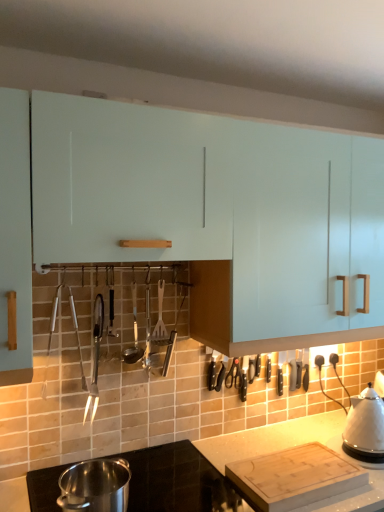
Question: Is the position of polished stainless steel ladle at center, positioned as the second silverware in right-to-left order, more distant than that of smooth white countertop at lower center?

Choices:
 (A) yes
 (B) no

Answer: (A)

Question: Is polished stainless steel ladle at center, positioned as the second silverware in right-to-left order, smaller than smooth white countertop at lower center?

Choices:
 (A) no
 (B) yes

Answer: (B)

Question: From a real-world perspective, is polished stainless steel ladle at center, which appears as the second silverware when viewed from the left, on smooth white countertop at lower center?

Choices:
 (A) no
 (B) yes

Answer: (B)

Question: Does polished stainless steel ladle at center, which appears as the second silverware when viewed from the left, have a lesser height compared to smooth white countertop at lower center?

Choices:
 (A) yes
 (B) no

Answer: (B)

Question: Considering the relative positions of polished stainless steel ladle at center, positioned as the second silverware in right-to-left order, and smooth white countertop at lower center in the image provided, is polished stainless steel ladle at center, positioned as the second silverware in right-to-left order, to the left of smooth white countertop at lower center from the viewer's perspective?

Choices:
 (A) no
 (B) yes

Answer: (B)

Question: Is white glossy kettle at right, the 2th kitchen appliance in the left-to-right sequence, in front of or behind wooden spatula at center, positioned as the third silverware in left-to-right order, in the image?

Choices:
 (A) behind
 (B) front

Answer: (B)

Question: From the image's perspective, is white glossy kettle at right, the 2th kitchen appliance in the left-to-right sequence, located above or below wooden spatula at center, which is counted as the 1th silverware, starting from the right?

Choices:
 (A) below
 (B) above

Answer: (A)

Question: From a real-world perspective, is white glossy kettle at right, which appears as the first kitchen appliance when viewed from the right, positioned above or below wooden spatula at center, positioned as the third silverware in left-to-right order?

Choices:
 (A) above
 (B) below

Answer: (B)

Question: In terms of height, does white glossy kettle at right, which appears as the first kitchen appliance when viewed from the right, look taller or shorter compared to wooden spatula at center, positioned as the third silverware in left-to-right order?

Choices:
 (A) tall
 (B) short

Answer: (B)

Question: From the image's perspective, is polished stainless steel ladle at center, positioned as the second silverware in right-to-left order, above or below polished stainless steel pot at lower left, the 2th kitchen appliance when ordered from back to front?

Choices:
 (A) below
 (B) above

Answer: (B)

Question: In the image, is polished stainless steel ladle at center, which appears as the second silverware when viewed from the left, on the left side or the right side of polished stainless steel pot at lower left, the second kitchen appliance viewed from the right?

Choices:
 (A) right
 (B) left

Answer: (A)

Question: Is polished stainless steel ladle at center, positioned as the second silverware in right-to-left order, spatially inside polished stainless steel pot at lower left, which is counted as the first kitchen appliance, starting from the front, or outside of it?

Choices:
 (A) outside
 (B) inside

Answer: (A)

Question: Does point (135, 310) appear closer or farther from the camera than point (74, 487)?

Choices:
 (A) closer
 (B) farther

Answer: (B)

Question: From a real-world perspective, is wooden spatula at center, positioned as the third silverware in left-to-right order, above or below white glossy kettle at right, the 2th kitchen appliance in the left-to-right sequence?

Choices:
 (A) below
 (B) above

Answer: (B)

Question: From the image's perspective, relative to white glossy kettle at right, the 2th kitchen appliance in the front-to-back sequence, is wooden spatula at center, which is counted as the 1th silverware, starting from the right, above or below?

Choices:
 (A) above
 (B) below

Answer: (A)